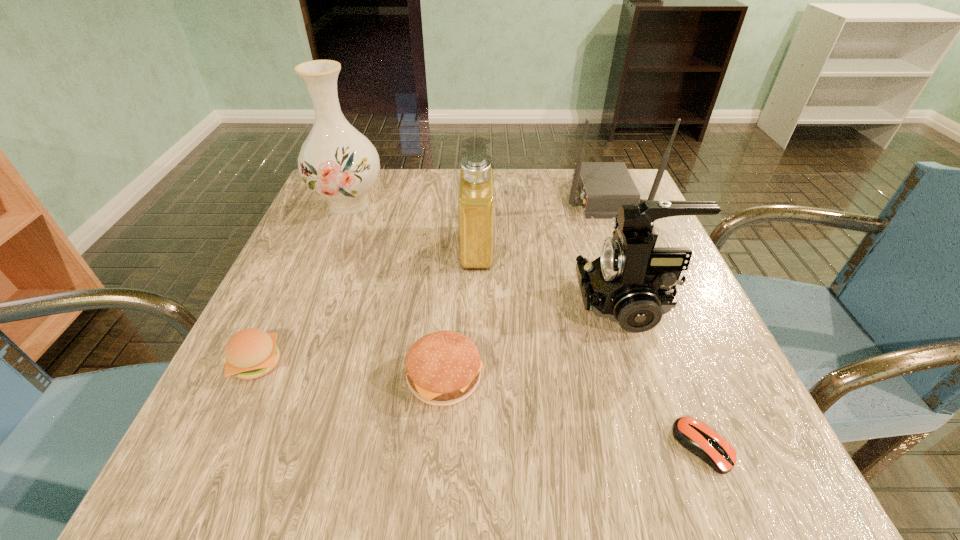
Find the location of `vacant space that satisfies the following two spatial constraints: 1. on the back of the computer mouse to connect cables; 2. on the left side of the router`. vacant space that satisfies the following two spatial constraints: 1. on the back of the computer mouse to connect cables; 2. on the left side of the router is located at coordinates (701, 447).

At what (x,y) coordinates should I click in order to perform the action: click on free space that satisfies the following two spatial constraints: 1. on the front-facing side of the fifth nearest object; 2. on the back side of the computer mouse. Please return your answer as a coordinate pair (x, y). The height and width of the screenshot is (540, 960). Looking at the image, I should click on tap(475, 447).